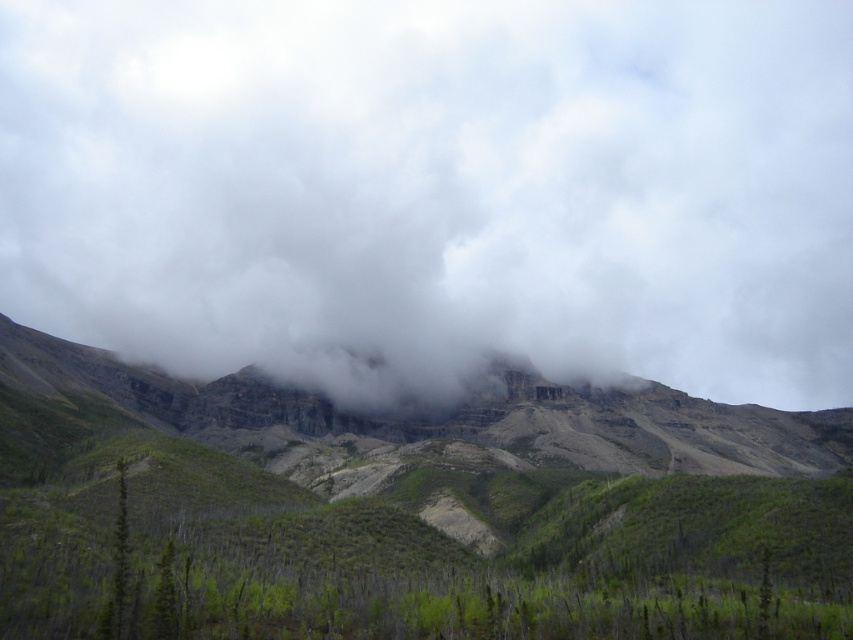
Which is more to the right, gray/cloudy mountain at upper center or green matte tree at left?

gray/cloudy mountain at upper center

Is point (488, 332) in front of point (123, 602)?

No, it is behind (123, 602).

This screenshot has width=853, height=640. I want to click on gray/cloudy mountain at upper center, so click(436, 189).

Is rocky cliff at center taller than green matte tree at left?

Yes.

Does point (575, 496) come farther from viewer compared to point (117, 529)?

Yes, it is.

Which is in front, point (527, 420) or point (122, 460)?

Point (122, 460) is more forward.

You are a GUI agent. You are given a task and a screenshot of the screen. Output one action in this format:
    pyautogui.click(x=<x>, y=<y>)
    Task: Click on the rocky cliff at center
    This screenshot has width=853, height=640.
    Given the screenshot: What is the action you would take?
    pyautogui.click(x=467, y=461)

Based on the photo, can you confirm if gray/cloudy mountain at upper center is taller than rocky cliff at center?

Indeed, gray/cloudy mountain at upper center has a greater height compared to rocky cliff at center.

From the picture: Is gray/cloudy mountain at upper center positioned at the back of rocky cliff at center?

Yes, it is.

Is point (703, 340) more distant than point (306, 442)?

That is True.

This screenshot has width=853, height=640. Find the location of `gray/cloudy mountain at upper center`. gray/cloudy mountain at upper center is located at coordinates (436, 189).